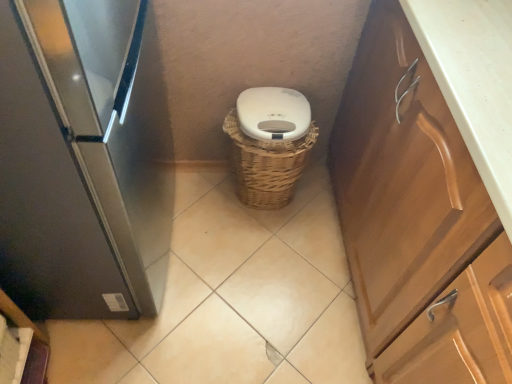
You are a GUI agent. You are given a task and a screenshot of the screen. Output one action in this format:
    pyautogui.click(x=<x>, y=<y>)
    Task: Click on the free space above white matte toilet bowl at center (from a real-world perspective)
    This screenshot has width=512, height=384.
    Given the screenshot: What is the action you would take?
    pyautogui.click(x=274, y=103)